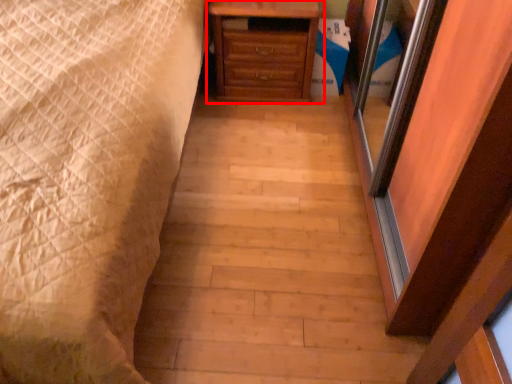
Question: From the image's perspective, considering the relative positions of chest of drawers (annotated by the red box) and bed in the image provided, where is chest of drawers (annotated by the red box) located with respect to the staircase?

Choices:
 (A) above
 (B) below

Answer: (A)